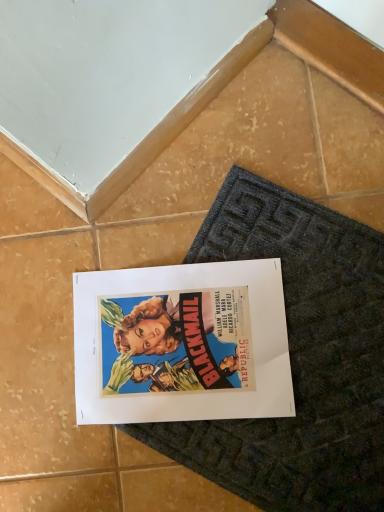
Question: From a real-world perspective, relative to matte paper poster at center, is dark gray textured bath mat at center vertically above or below?

Choices:
 (A) below
 (B) above

Answer: (A)

Question: Is dark gray textured bath mat at center inside the boundaries of matte paper poster at center, or outside?

Choices:
 (A) inside
 (B) outside

Answer: (B)

Question: From the image's perspective, is dark gray textured bath mat at center located above or below matte paper poster at center?

Choices:
 (A) below
 (B) above

Answer: (A)

Question: Is point (135, 399) positioned closer to the camera than point (317, 269)?

Choices:
 (A) farther
 (B) closer

Answer: (B)

Question: In terms of size, does matte paper poster at center appear bigger or smaller than dark gray textured bath mat at center?

Choices:
 (A) big
 (B) small

Answer: (B)

Question: From a real-world perspective, is matte paper poster at center physically located above or below dark gray textured bath mat at center?

Choices:
 (A) above
 (B) below

Answer: (A)

Question: In terms of height, does matte paper poster at center look taller or shorter compared to dark gray textured bath mat at center?

Choices:
 (A) tall
 (B) short

Answer: (A)